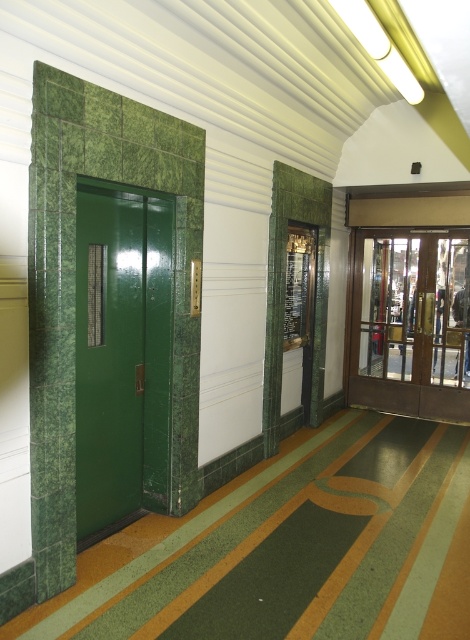
Does green glossy elevator at left have a greater height compared to green polished wood elevator at center?

No, green glossy elevator at left is not taller than green polished wood elevator at center.

Based on the photo, is green glossy elevator at left below green polished wood elevator at center?

Correct, green glossy elevator at left is located below green polished wood elevator at center.

The width and height of the screenshot is (470, 640). In order to click on green glossy elevator at left in this screenshot , I will do `click(122, 355)`.